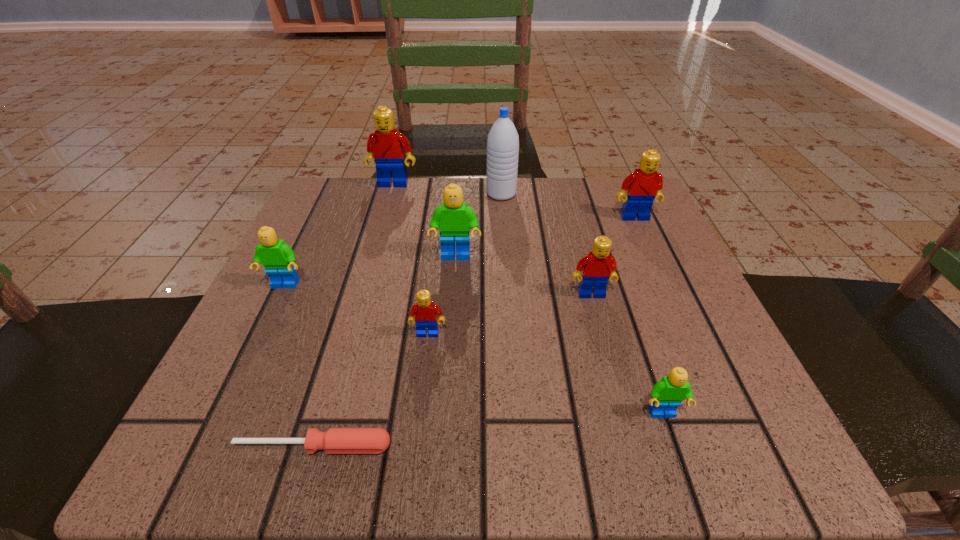
This screenshot has height=540, width=960. Find the location of `object that is the sixth closest one to the rightmost red Lego`. object that is the sixth closest one to the rightmost red Lego is located at coordinates (425, 312).

At what (x,y) coordinates should I click in order to perform the action: click on object that is the fifth closest to the third farthest red Lego. Please return your answer as a coordinate pair (x, y). This screenshot has width=960, height=540. Looking at the image, I should click on (503, 140).

Where is `the seventh closest Lego to the red screwdriver`? The height and width of the screenshot is (540, 960). the seventh closest Lego to the red screwdriver is located at coordinates (645, 184).

Select which Lego is the seventh closest to the screwdriver. Please provide its 2D coordinates. Your answer should be formatted as a tuple, i.e. [(x, y)], where the tuple contains the x and y coordinates of a point satisfying the conditions above.

[(645, 184)]

Choose which red Lego is the second nearest neighbor to the tallest Lego. Please provide its 2D coordinates. Your answer should be formatted as a tuple, i.e. [(x, y)], where the tuple contains the x and y coordinates of a point satisfying the conditions above.

[(645, 184)]

The width and height of the screenshot is (960, 540). In order to click on red Lego that stands as the fourth closest to the nearest green Lego in this screenshot , I will do `click(386, 147)`.

Identify which green Lego is the second nearest to the blue water bottle. Please provide its 2D coordinates. Your answer should be formatted as a tuple, i.e. [(x, y)], where the tuple contains the x and y coordinates of a point satisfying the conditions above.

[(278, 258)]

Identify the location of green Lego that is the second closest one to the second smallest red Lego. The width and height of the screenshot is (960, 540). (666, 396).

You are a GUI agent. You are given a task and a screenshot of the screen. Output one action in this format:
    pyautogui.click(x=<x>, y=<y>)
    Task: Click on the free space that satisfies the following two spatial constraints: 1. on the face of the leftmost green Lego; 2. on the left side of the red screwdriver
    The image size is (960, 540).
    Given the screenshot: What is the action you would take?
    pyautogui.click(x=208, y=446)